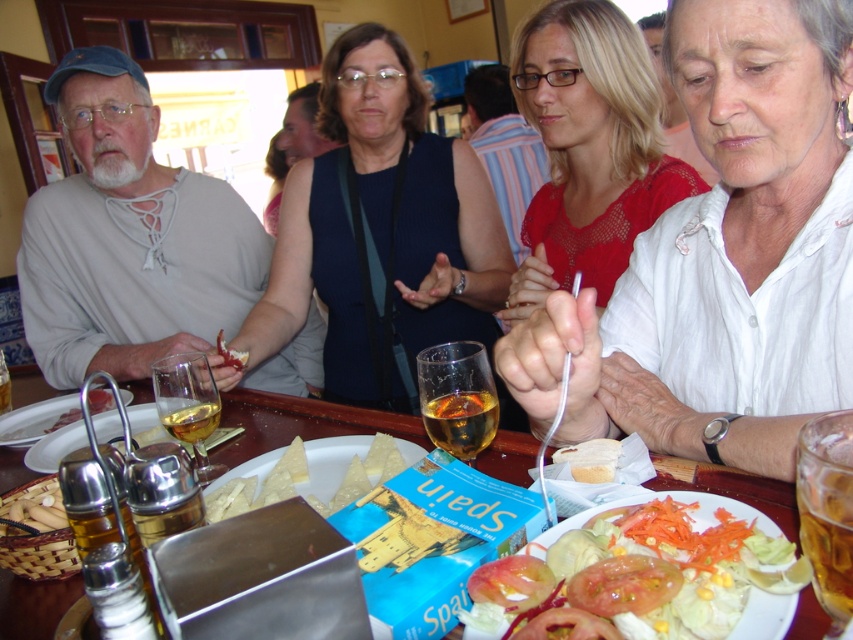
Is point (608, 184) closer to viewer compared to point (47, 504)?

No, it is behind (47, 504).

Which is more to the left, red lace dress at center or smooth wooden sticks at lower left?

smooth wooden sticks at lower left

Who is more forward, (523, 266) or (56, 522)?

Positioned in front is point (56, 522).

Find the location of a particular element. red lace dress at center is located at coordinates (589, 148).

Is point (61, 234) behind point (817, 468)?

That is True.

Is light gray knit sweater at left to the left of amber glass beer at lower right from the viewer's perspective?

Yes, light gray knit sweater at left is to the left of amber glass beer at lower right.

From the picture: Measure the distance between point (140, 296) and camera.

Point (140, 296) is 1.68 meters away from camera.

Locate an element on the screen. The image size is (853, 640). light gray knit sweater at left is located at coordinates [x=128, y=237].

Is blue knitted sweater at center positioned before red lace dress at center?

Yes, blue knitted sweater at center is in front of red lace dress at center.

Does blue knitted sweater at center have a lesser width compared to red lace dress at center?

No, blue knitted sweater at center is not thinner than red lace dress at center.

In order to click on blue knitted sweater at center in this screenshot , I will do `click(381, 230)`.